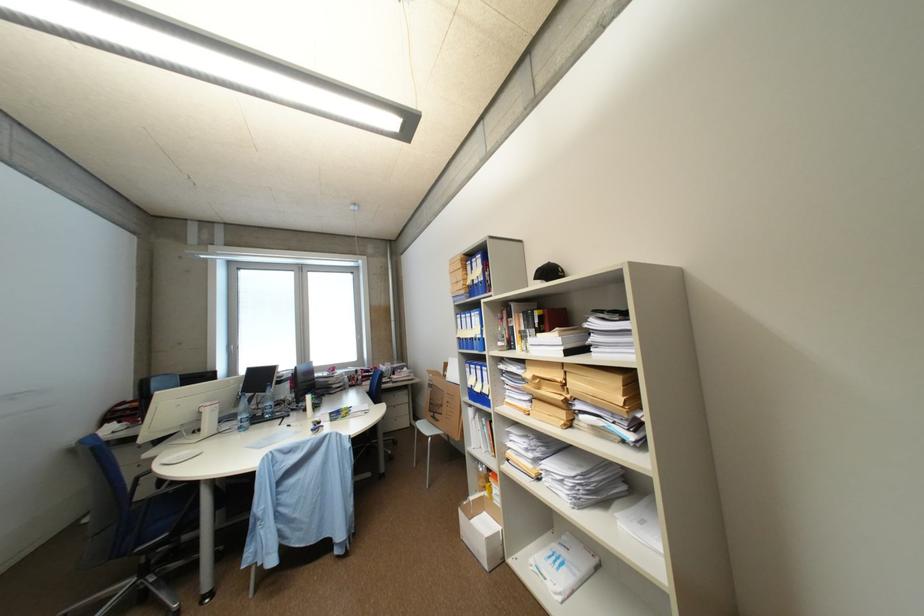
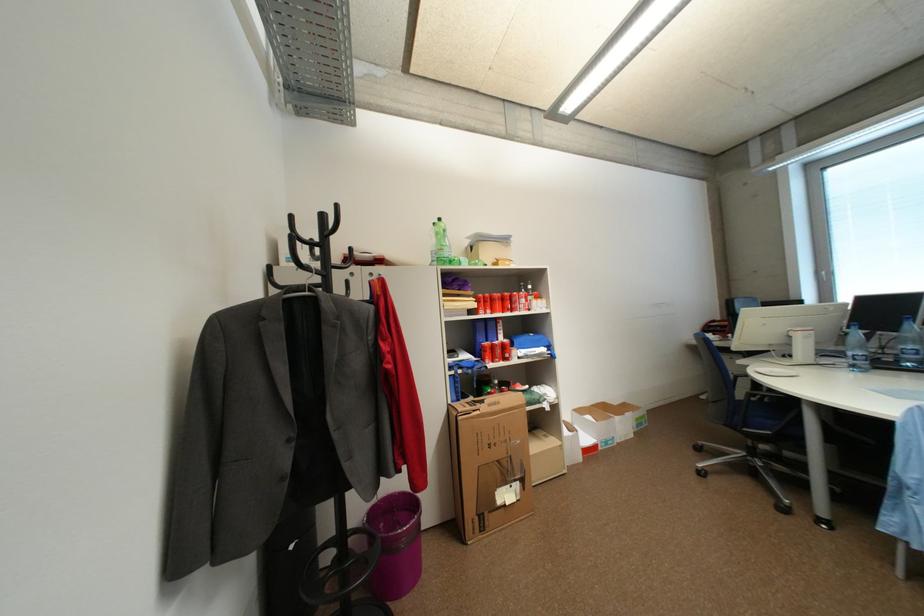
Locate, in the second image, the point that corresponds to the point at 249,429 in the first image.

(861, 367)